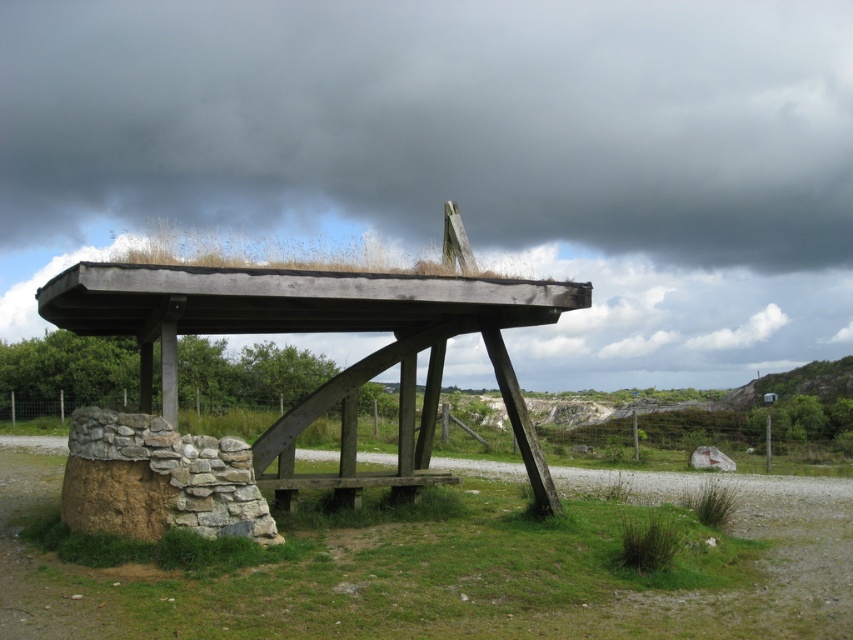
Question: Which of the following is the farthest from the observer?

Choices:
 (A) (320, 486)
 (B) (337, 289)

Answer: (A)

Question: Does wooden gazebo at center have a greater width compared to brown wooden bench at center?

Choices:
 (A) yes
 (B) no

Answer: (A)

Question: Is wooden gazebo at center above brown wooden bench at center?

Choices:
 (A) no
 (B) yes

Answer: (B)

Question: Among these objects, which one is nearest to the camera?

Choices:
 (A) wooden gazebo at center
 (B) brown wooden bench at center

Answer: (A)

Question: Is wooden gazebo at center wider than brown wooden bench at center?

Choices:
 (A) yes
 (B) no

Answer: (A)

Question: Which of the following is the farthest from the observer?

Choices:
 (A) [x=430, y=477]
 (B) [x=178, y=310]

Answer: (A)